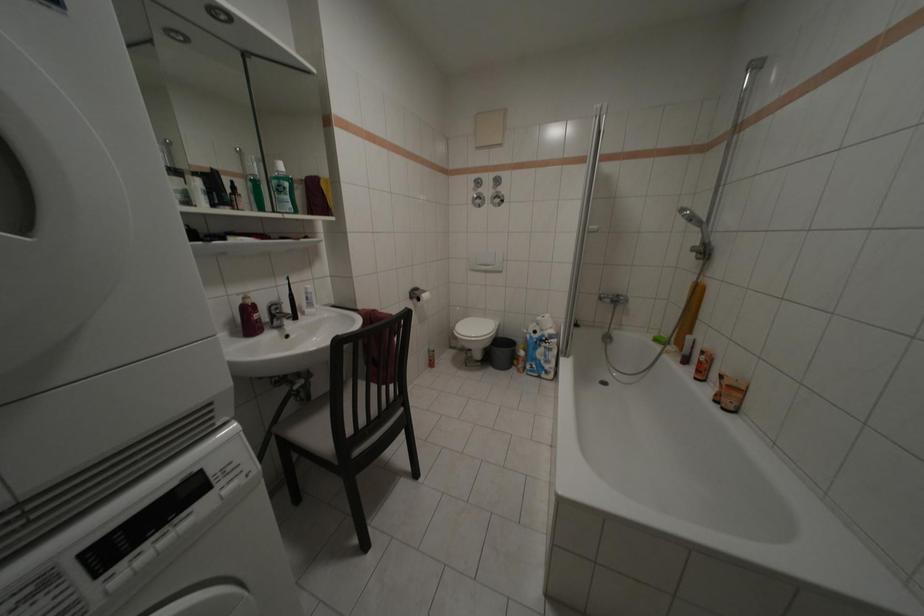
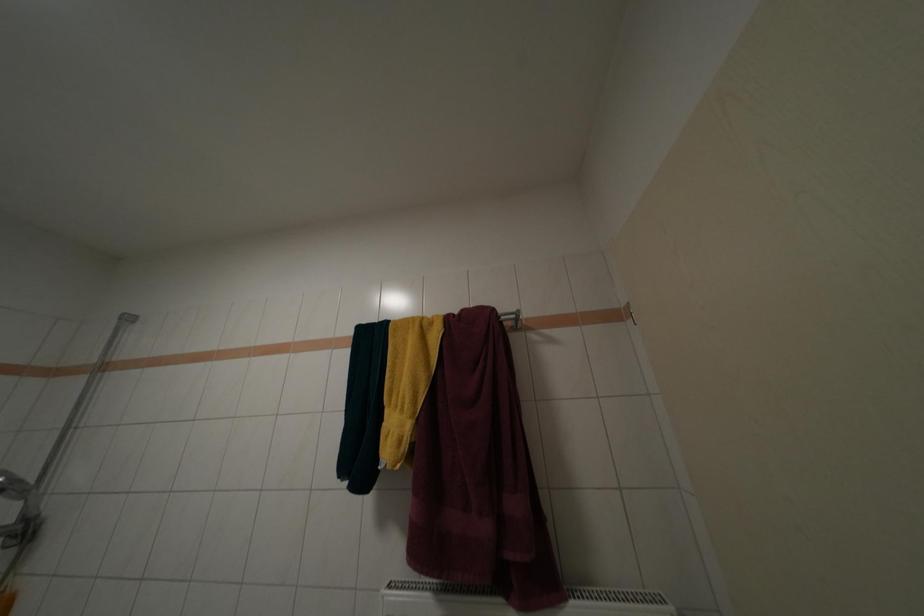
The first image is from the beginning of the video and the second image is from the end. How did the camera likely rotate when shooting the video?

The camera's rotation is toward right-up.